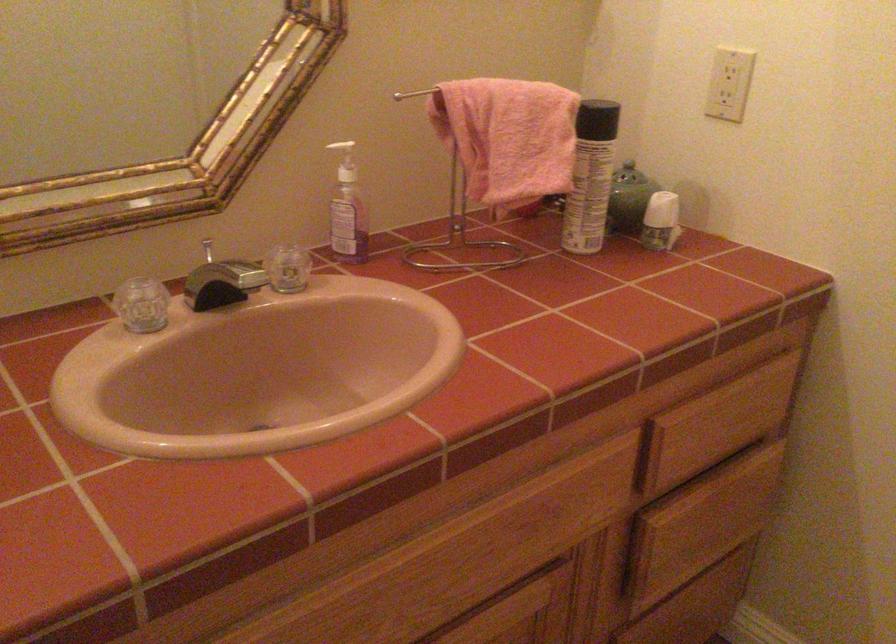
You are a GUI agent. You are given a task and a screenshot of the screen. Output one action in this format:
    pyautogui.click(x=<x>, y=<y>)
    Task: Click on the white deodorant stick
    This screenshot has width=896, height=644.
    Given the screenshot: What is the action you would take?
    pyautogui.click(x=590, y=176)